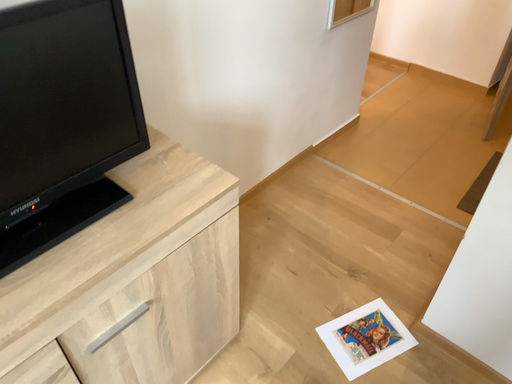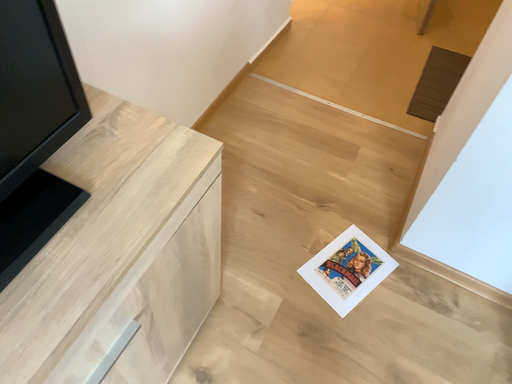
Question: Which way did the camera rotate in the video?

Choices:
 (A) rotated left
 (B) rotated right

Answer: (B)